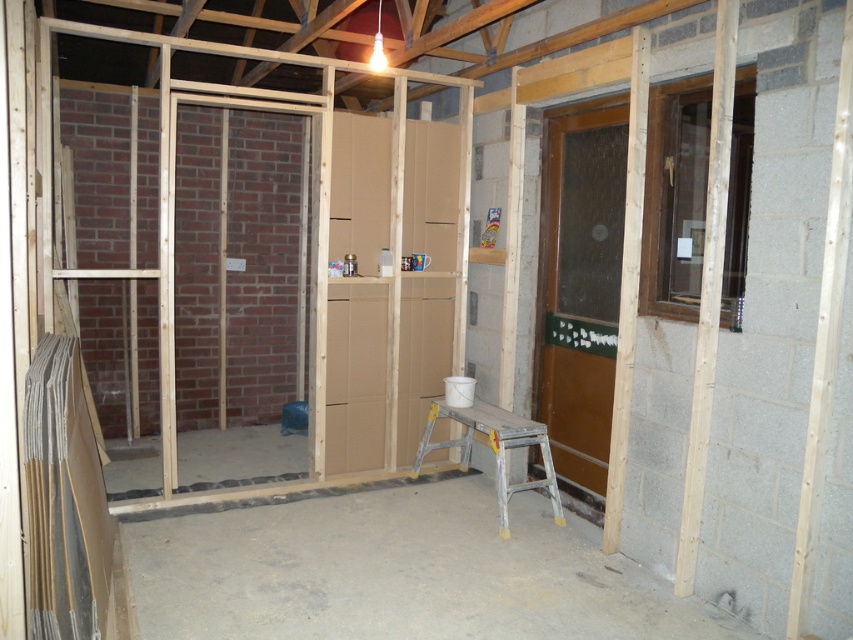
Consider the image. Is smooth wood beam at right to the left of light brown wood at right from the viewer's perspective?

Incorrect, smooth wood beam at right is not on the left side of light brown wood at right.

Is smooth wood beam at right wider than light brown wood at right?

Indeed, smooth wood beam at right has a greater width compared to light brown wood at right.

Does point (726, 112) come in front of point (636, 88)?

Yes, point (726, 112) is in front of point (636, 88).

The width and height of the screenshot is (853, 640). Find the location of `smooth wood beam at right`. smooth wood beam at right is located at coordinates (708, 292).

Is point (630, 58) positioned before point (555, 515)?

Yes, point (630, 58) is in front of point (555, 515).

Between light brown wood at right and silver metallic stool at center, which one has less height?

silver metallic stool at center

Who is more forward, (x=614, y=444) or (x=546, y=486)?

Positioned in front is point (x=614, y=444).

Find the location of a particular element. light brown wood at right is located at coordinates (627, 285).

Does smooth wood beam at right have a greater height compared to silver metallic stool at center?

Indeed, smooth wood beam at right has a greater height compared to silver metallic stool at center.

Is smooth wood beam at right to the right of silver metallic stool at center from the viewer's perspective?

Indeed, smooth wood beam at right is positioned on the right side of silver metallic stool at center.

Image resolution: width=853 pixels, height=640 pixels. In order to click on smooth wood beam at right in this screenshot , I will do `click(708, 292)`.